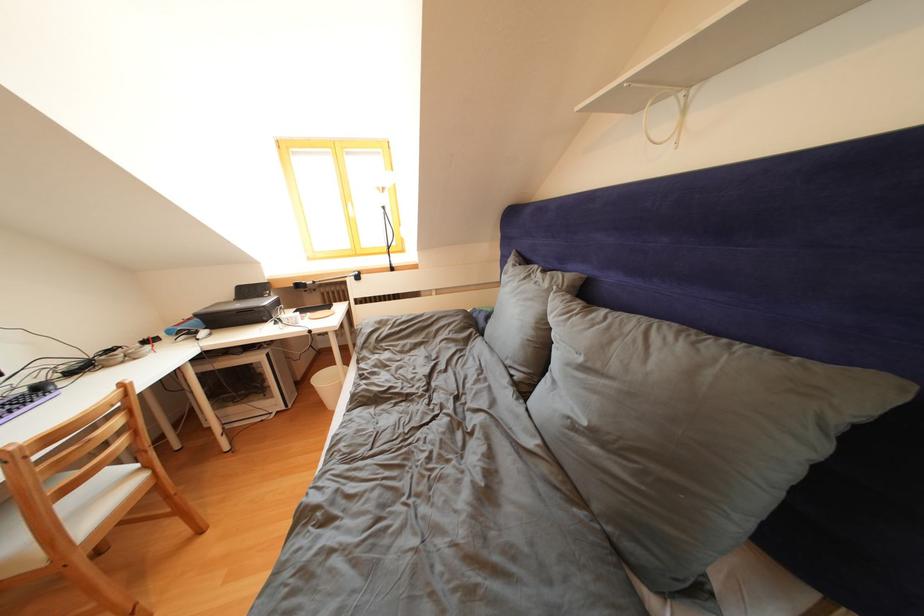
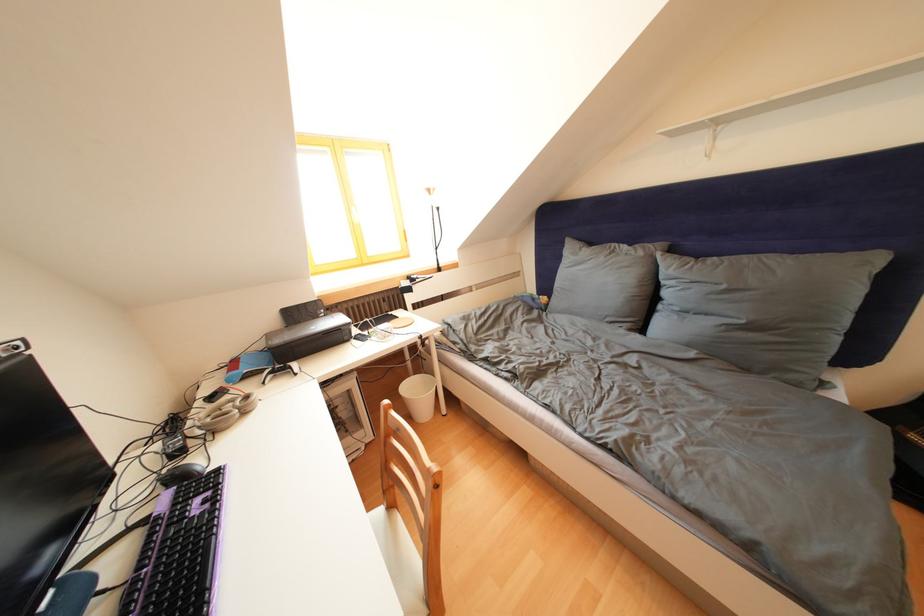
Locate, in the second image, the point that corresponds to (153,347) in the first image.

(220, 403)